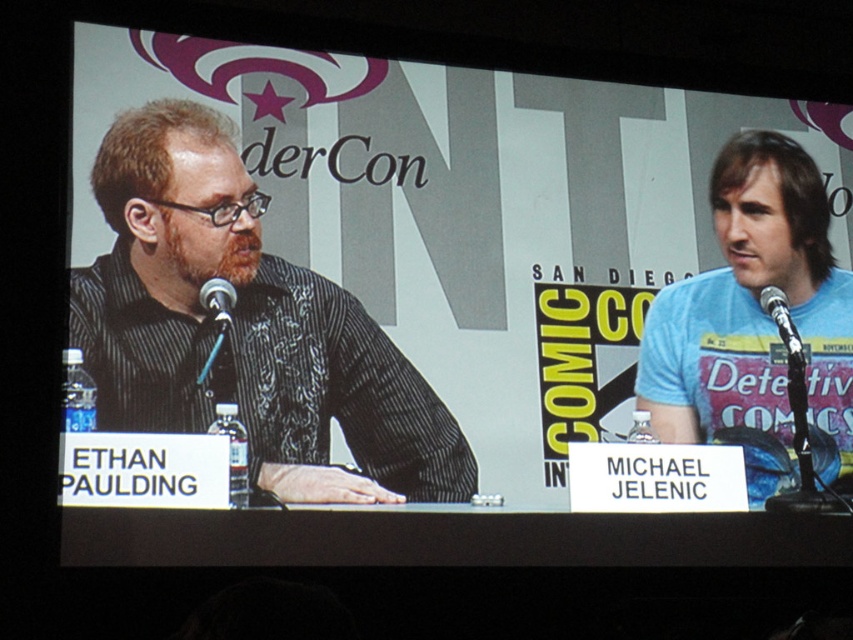
You are attending a panel discussion at WonderCon and notice two points on the stage. The first point is at coordinates point (x=229, y=266) and the second is at point (x=224, y=312). From your perspective as an attendee sitting in the front row, which point is closer to the stage edge?

Point (x=224, y=312) is closer to the stage edge because it is in front of point (x=229, y=266), which is further back on the stage.

You are a photographer at the event and need to capture a clear shot of both the black textured shirt at left and the black plastic microphone at left. Based on their positions, which object should you focus on first to ensure both are in frame?

The black textured shirt at left might be wider than the black plastic microphone at left, so focusing on the shirt first ensures the microphone will still be in frame since it is narrower.